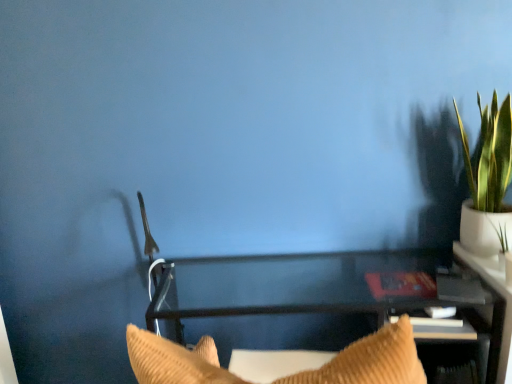
Question: From a real-world perspective, is clear glass table at center located higher than green leafy plant in white pot at upper right?

Choices:
 (A) no
 (B) yes

Answer: (A)

Question: Can you confirm if clear glass table at center is bigger than green leafy plant in white pot at upper right?

Choices:
 (A) yes
 (B) no

Answer: (A)

Question: Is clear glass table at center turned away from green leafy plant in white pot at upper right?

Choices:
 (A) yes
 (B) no

Answer: (B)

Question: Is clear glass table at center next to green leafy plant in white pot at upper right?

Choices:
 (A) yes
 (B) no

Answer: (B)

Question: From the image's perspective, is clear glass table at center over green leafy plant in white pot at upper right?

Choices:
 (A) yes
 (B) no

Answer: (B)

Question: Does clear glass table at center have a lesser width compared to green leafy plant in white pot at upper right?

Choices:
 (A) yes
 (B) no

Answer: (B)

Question: Does green leafy plant in white pot at upper right come in front of clear glass table at center?

Choices:
 (A) no
 (B) yes

Answer: (A)

Question: Is green leafy plant in white pot at upper right oriented away from clear glass table at center?

Choices:
 (A) yes
 (B) no

Answer: (B)

Question: From the image's perspective, does green leafy plant in white pot at upper right appear lower than clear glass table at center?

Choices:
 (A) no
 (B) yes

Answer: (A)

Question: Can you confirm if green leafy plant in white pot at upper right is positioned to the right of clear glass table at center?

Choices:
 (A) no
 (B) yes

Answer: (B)

Question: Can you confirm if green leafy plant in white pot at upper right is taller than clear glass table at center?

Choices:
 (A) no
 (B) yes

Answer: (B)

Question: From the image's perspective, would you say green leafy plant in white pot at upper right is positioned over clear glass table at center?

Choices:
 (A) no
 (B) yes

Answer: (B)

Question: In terms of width, does clear glass table at center look wider or thinner when compared to green leafy plant in white pot at upper right?

Choices:
 (A) thin
 (B) wide

Answer: (B)